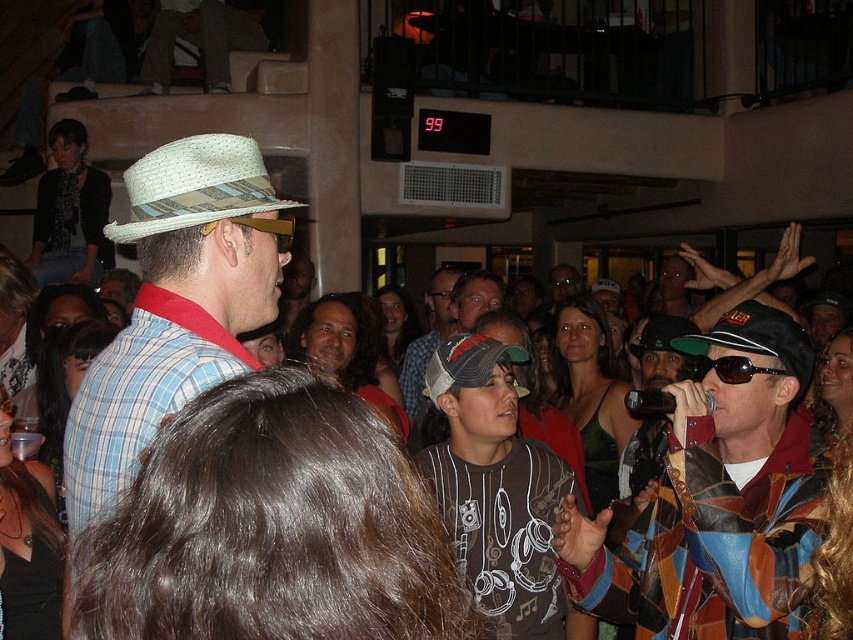
Question: Can you confirm if dark brown t-shirt at center is positioned above black fabric cap at center?

Choices:
 (A) no
 (B) yes

Answer: (A)

Question: Is leather jacket at center further to camera compared to light blue plaid shirt at center?

Choices:
 (A) yes
 (B) no

Answer: (A)

Question: Which of the following is the farthest from the observer?

Choices:
 (A) matte straw hat at upper left
 (B) straw fedora at center
 (C) long hair at center
 (D) denim cap at center

Answer: (A)

Question: Which point is farther from the camera taking this photo?

Choices:
 (A) (776, 332)
 (B) (329, 348)
 (C) (77, 132)

Answer: (C)

Question: Does straw fedora at center appear on the right side of long hair at center?

Choices:
 (A) no
 (B) yes

Answer: (A)

Question: Which object is closer to the camera taking this photo?

Choices:
 (A) black fabric cap at center
 (B) dark brown t-shirt at center

Answer: (A)